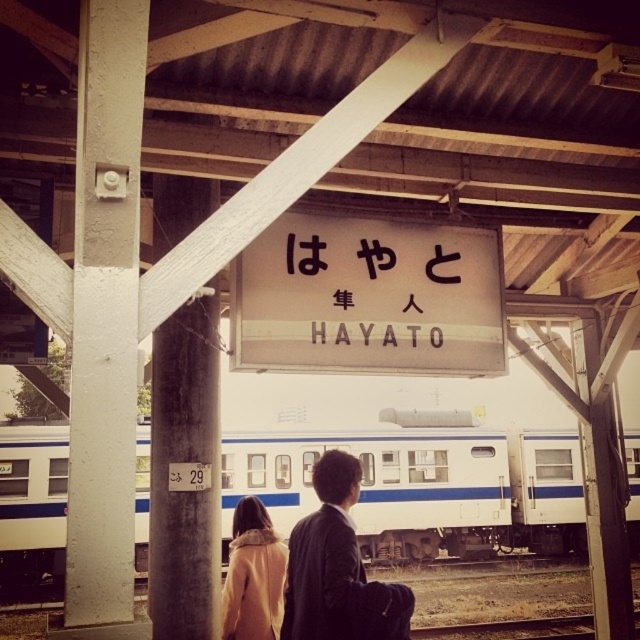
Between white painted wood at left and white matte sign at center, which one is positioned higher?

white matte sign at center

Between point (140, 67) and point (424, 288), which one is positioned behind?

The point (424, 288) is behind.

Which is behind, point (112, 164) or point (326, 224)?

Positioned behind is point (326, 224).

Where is `white painted wood at left`? white painted wood at left is located at coordinates (104, 314).

Is white glossy train at center bigger than light brown fur coat at center?

Yes.

Is white glossy train at center to the right of light brown fur coat at center from the viewer's perspective?

Correct, you'll find white glossy train at center to the right of light brown fur coat at center.

Who is more distant from viewer, (419,442) or (228,605)?

Point (419,442)

The height and width of the screenshot is (640, 640). I want to click on white glossy train at center, so click(x=422, y=484).

Can you confirm if white painted wood at left is smaller than blackmaterial/texturesign at center?

No.

Between white painted wood at left and blackmaterial/texturesign at center, which one has more height?

With more height is white painted wood at left.

This screenshot has width=640, height=640. Describe the element at coordinates (104, 314) in the screenshot. I see `white painted wood at left` at that location.

Where is `white painted wood at left`? white painted wood at left is located at coordinates (104, 314).